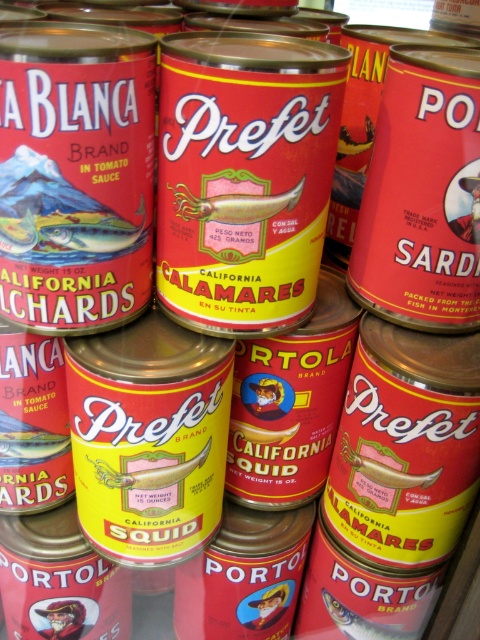
Question: Does yellow matte squid at center appear on the right side of shiny silver fish at center?

Choices:
 (A) no
 (B) yes

Answer: (A)

Question: Is yellow matte squid at center positioned behind shiny silver fish at center?

Choices:
 (A) yes
 (B) no

Answer: (B)

Question: Which point appears farthest from the camera in this image?

Choices:
 (A) (351, 632)
 (B) (269, 202)

Answer: (A)

Question: Which object is farther from the camera taking this photo?

Choices:
 (A) shiny silver fish at center
 (B) yellow matte squid at center

Answer: (A)

Question: Is the position of yellow matte squid at center less distant than that of shiny silver fish at center?

Choices:
 (A) no
 (B) yes

Answer: (B)